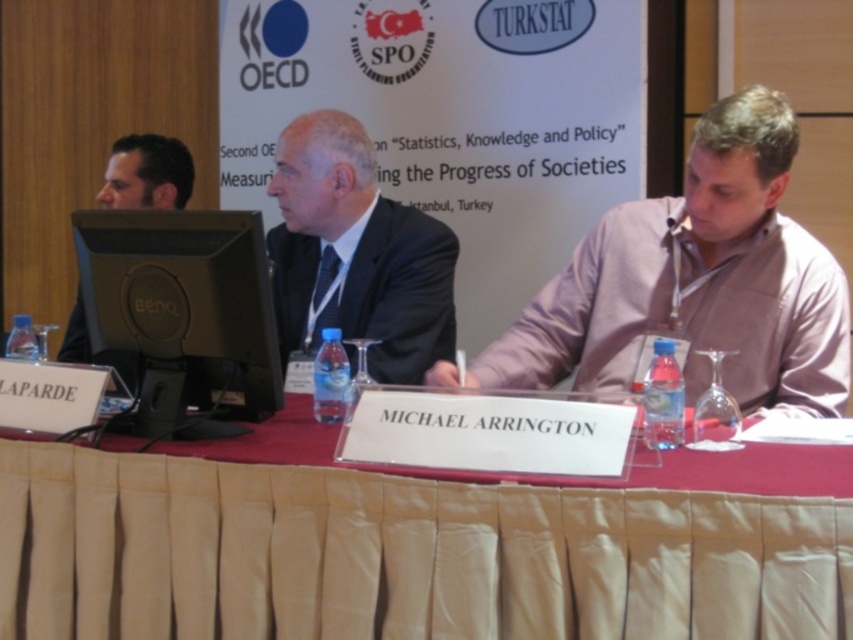
Is point (790, 365) in front of point (115, 211)?

That is False.

Is pink cotton shirt at center to the right of black glossy monitor at center from the viewer's perspective?

Indeed, pink cotton shirt at center is positioned on the right side of black glossy monitor at center.

Is point (788, 230) behind point (260, 298)?

Yes, it is behind point (260, 298).

The height and width of the screenshot is (640, 853). Find the location of `pink cotton shirt at center`. pink cotton shirt at center is located at coordinates (697, 280).

Who is lower down, beige fabric tablecloth at center or matte black monitor at left?

beige fabric tablecloth at center is below.

Which is above, beige fabric tablecloth at center or matte black monitor at left?

matte black monitor at left is higher up.

Which is behind, point (4, 620) or point (149, 145)?

The point (149, 145) is behind.

You are a GUI agent. You are given a task and a screenshot of the screen. Output one action in this format:
    pyautogui.click(x=<x>, y=<y>)
    Task: Click on the beige fabric tablecloth at center
    The height and width of the screenshot is (640, 853).
    Given the screenshot: What is the action you would take?
    pyautogui.click(x=416, y=544)

Based on the photo, who is more forward, (700, 372) or (120, 160)?

Point (700, 372) is in front.

Can you confirm if pink cotton shirt at center is positioned above matte black monitor at left?

No, pink cotton shirt at center is not above matte black monitor at left.

What do you see at coordinates (697, 280) in the screenshot? The image size is (853, 640). I see `pink cotton shirt at center` at bounding box center [697, 280].

This screenshot has width=853, height=640. I want to click on pink cotton shirt at center, so click(697, 280).